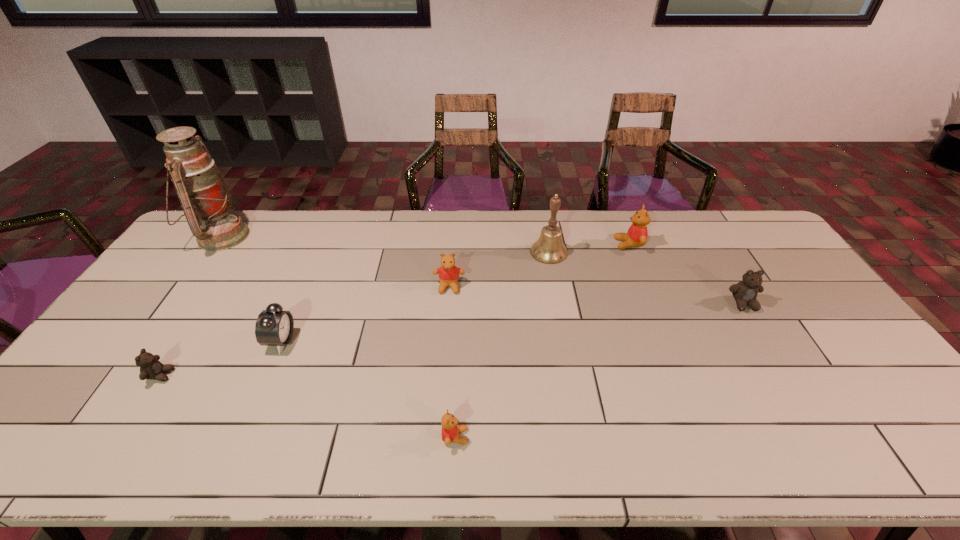
This screenshot has height=540, width=960. Identify the location of free space between the second biggest red teddy bear and the smallest red teddy bear. (452, 362).

The width and height of the screenshot is (960, 540). What are the coordinates of `empty location between the leftmost teddy bear and the second smallest red teddy bear` in the screenshot? It's located at (305, 331).

This screenshot has height=540, width=960. I want to click on free point between the nearest red teddy bear and the third object from right to left, so click(502, 345).

You are a GUI agent. You are given a task and a screenshot of the screen. Output one action in this format:
    pyautogui.click(x=<x>, y=<y>)
    Task: Click on the vacant space in between the bell and the nearest red teddy bear
    The image size is (960, 540).
    Given the screenshot: What is the action you would take?
    pyautogui.click(x=502, y=345)

Select which object is the seventh closest to the seventh farthest object. Please provide its 2D coordinates. Your answer should be formatted as a tuple, i.e. [(x, y)], where the tuple contains the x and y coordinates of a point satisfying the conditions above.

[(745, 292)]

Choose which object is the fourth nearest neighbor to the tallest object. Please provide its 2D coordinates. Your answer should be formatted as a tuple, i.e. [(x, y)], where the tuple contains the x and y coordinates of a point satisfying the conditions above.

[(450, 430)]

Identify which teddy bear is the fourth nearest to the tallest teddy bear. Please provide its 2D coordinates. Your answer should be formatted as a tuple, i.e. [(x, y)], where the tuple contains the x and y coordinates of a point satisfying the conditions above.

[(151, 368)]

Locate an element on the screen. teddy bear that is the second nearest to the tallest object is located at coordinates (448, 273).

The width and height of the screenshot is (960, 540). In order to click on red teddy bear that stands as the second closest to the second smallest red teddy bear in this screenshot , I will do `click(637, 234)`.

Locate an element on the screen. The width and height of the screenshot is (960, 540). red teddy bear that is the second nearest to the second smallest red teddy bear is located at coordinates (637, 234).